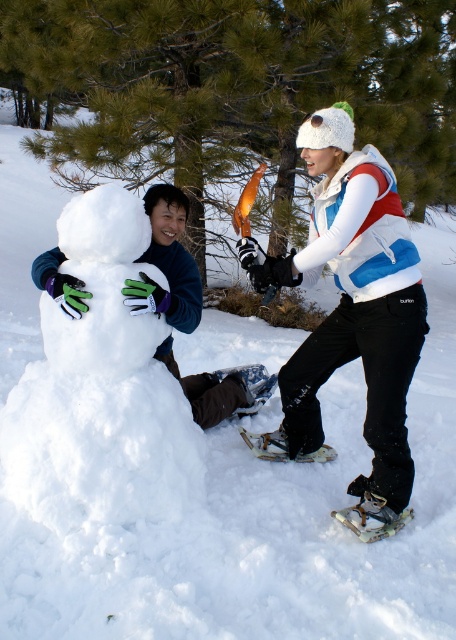
You are a delivery robot with a 30 inch wide package. You need to move from the white fleece jacket at upper right to the white plastic snowshoe at lower center. Is there enough space to pass through the area between them?

The distance between the white fleece jacket at upper right and the white plastic snowshoe at lower center is 34.88 inches. Since the package is 30 inches wide, there is enough space for the delivery robot to pass through.

You are trying to determine if you can place the metallic silver snowshoe at lower right on top of the white fleece jacket at upper right. Based on their sizes, is this possible?

The white fleece jacket at upper right is much taller than the metallic silver snowshoe at lower right, so it is possible to place the metallic silver snowshoe at lower right on top of the white fleece jacket at upper right since it is shorter.

You are a winter explorer who needs to place a 24 inch long snowboard between the white rubber snowshoe at lower center and the white plastic snowshoe at lower center. Can you fit it there?

The white rubber snowshoe at lower center and white plastic snowshoe at lower center are 25.76 inches apart, so yes, the snowboard can fit between them since it is shorter than the space available.